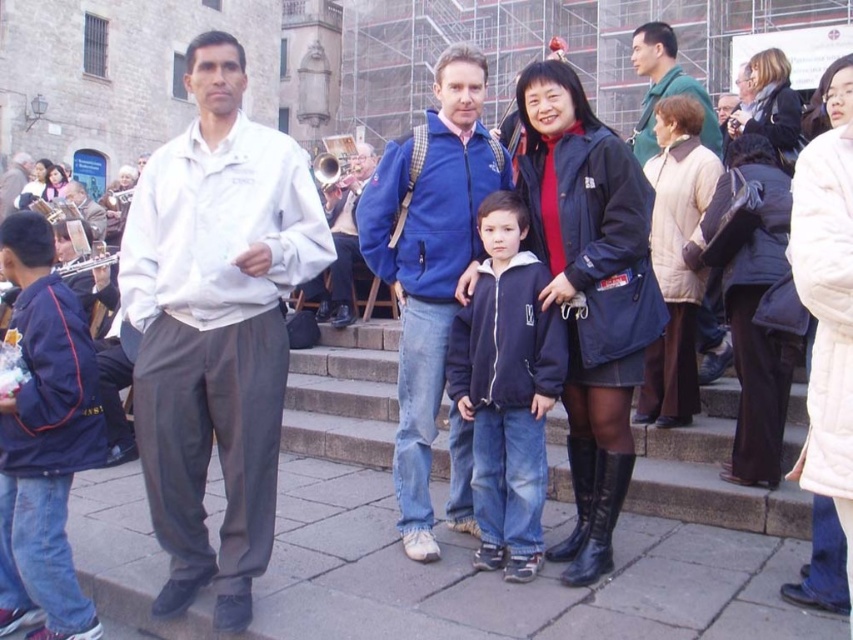
Question: Estimate the real-world distances between objects in this image. Which object is farther from the white cotton shirt at left?

Choices:
 (A) green matte jacket at upper right
 (B) blue fabric jacket at center
 (C) green fabric shirt at upper right

Answer: (C)

Question: Is white cotton shirt at left to the right of blue fleece jacket at center from the viewer's perspective?

Choices:
 (A) no
 (B) yes

Answer: (A)

Question: Is blue fleece jacket at center positioned behind blue fabric jacket at center?

Choices:
 (A) no
 (B) yes

Answer: (A)

Question: Does navy blue fleece jacket at center have a lesser width compared to green matte jacket at upper right?

Choices:
 (A) yes
 (B) no

Answer: (A)

Question: Which point appears closest to the camera in this image?

Choices:
 (A) (508, 166)
 (B) (526, 435)
 (C) (276, 237)
 (D) (650, 54)

Answer: (C)

Question: Which point appears farthest from the camera in this image?

Choices:
 (A) pos(450,248)
 (B) pos(350,224)
 (C) pos(657,67)

Answer: (B)